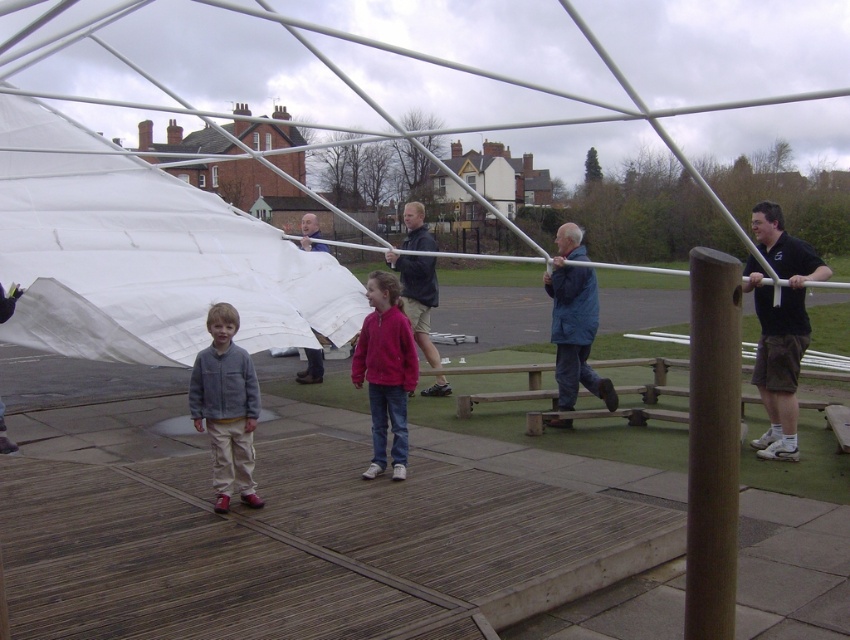
Does black shirt at right appear over blue fabric jacket at center?

Actually, black shirt at right is below blue fabric jacket at center.

Is black shirt at right shorter than blue fabric jacket at center?

In fact, black shirt at right may be taller than blue fabric jacket at center.

Does point (777, 209) come closer to viewer compared to point (573, 381)?

Yes, it is in front of point (573, 381).

At what (x,y) coordinates should I click in order to perform the action: click on black shirt at right. Please return your answer as a coordinate pair (x, y). The width and height of the screenshot is (850, 640). Looking at the image, I should click on (779, 326).

Who is more distant from viewer, (x=245, y=401) or (x=307, y=365)?

The point (x=307, y=365) is behind.

Locate an element on the screen. This screenshot has width=850, height=640. light gray fleece jacket at center is located at coordinates (225, 406).

Is point (238, 401) positioned behind point (310, 221)?

No, it is in front of (310, 221).

You are a GUI agent. You are given a task and a screenshot of the screen. Output one action in this format:
    pyautogui.click(x=<x>, y=<y>)
    Task: Click on the light gray fleece jacket at center
    This screenshot has height=640, width=850.
    Given the screenshot: What is the action you would take?
    pyautogui.click(x=225, y=406)

How far apart are black shirt at right and light gray fleece jacket at center?

A distance of 4.09 meters exists between black shirt at right and light gray fleece jacket at center.

Is black shirt at right wider than light gray fleece jacket at center?

Indeed, black shirt at right has a greater width compared to light gray fleece jacket at center.

Which is behind, point (803, 314) or point (250, 380)?

The point (803, 314) is more distant.

What are the coordinates of `black shirt at right` in the screenshot? It's located at pyautogui.click(x=779, y=326).